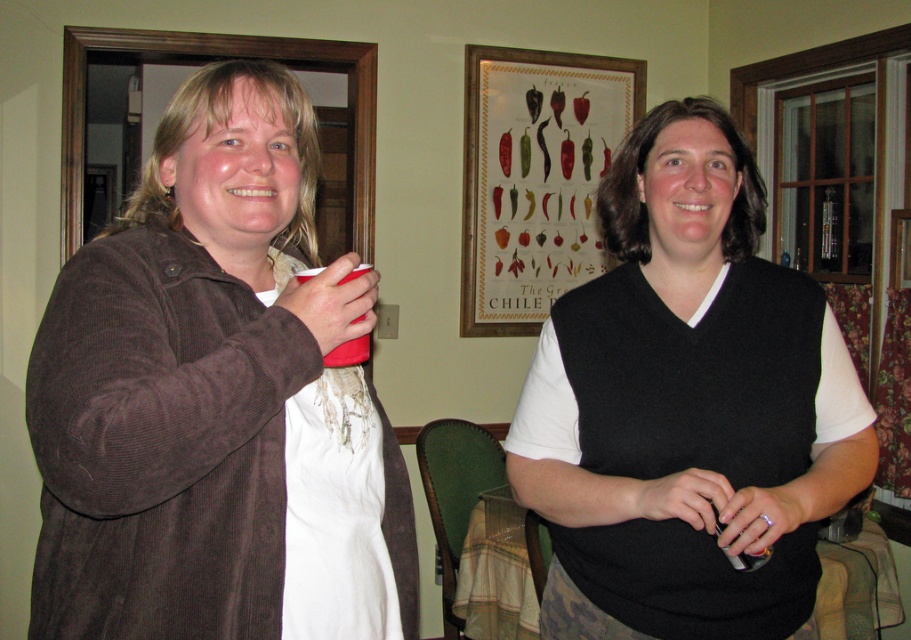
You are a fashion designer observing the two items at the left side of the image. Which one is bigger in size between the brown corduroy jacket at left and the white lace apron at left?

The brown corduroy jacket at left is larger in size compared to the white lace apron at left.